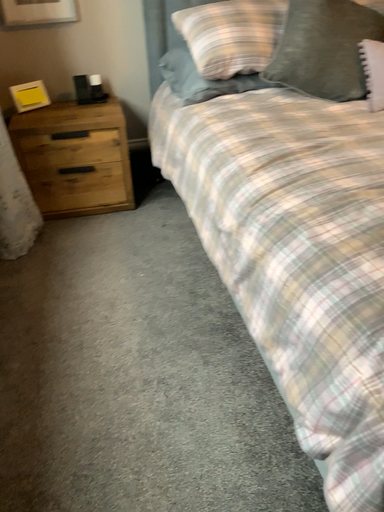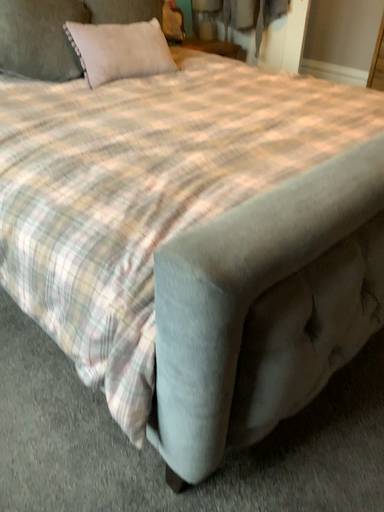
Question: How did the camera likely rotate when shooting the video?

Choices:
 (A) rotated left
 (B) rotated right

Answer: (B)